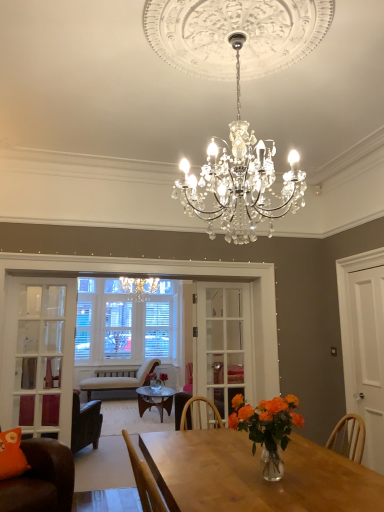
At what (x,y) coordinates should I click in order to perform the action: click on free point above white glass door at left, which is counted as the first glass door, starting from the front (from a real-world perspective). Please return your answer as a coordinate pair (x, y). The height and width of the screenshot is (512, 384). Looking at the image, I should click on (52, 274).